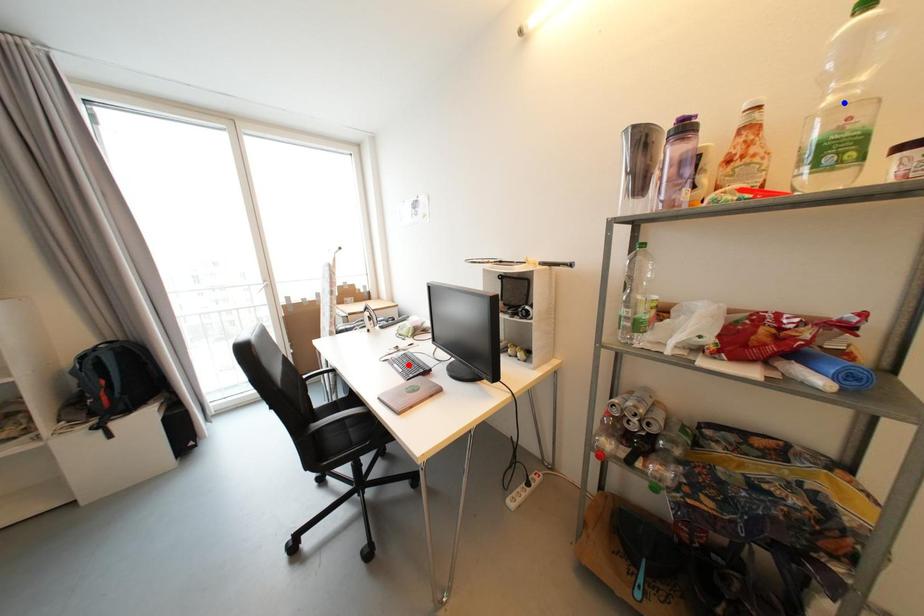
Question: Two points are marked on the image. Which point is closer to the camera?

Choices:
 (A) Blue point is closer.
 (B) Red point is closer.

Answer: (A)